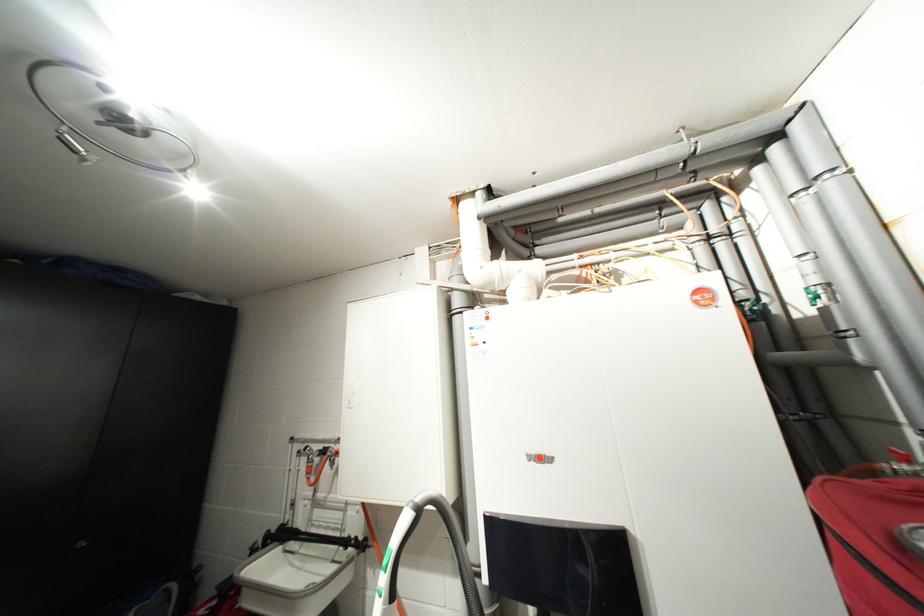
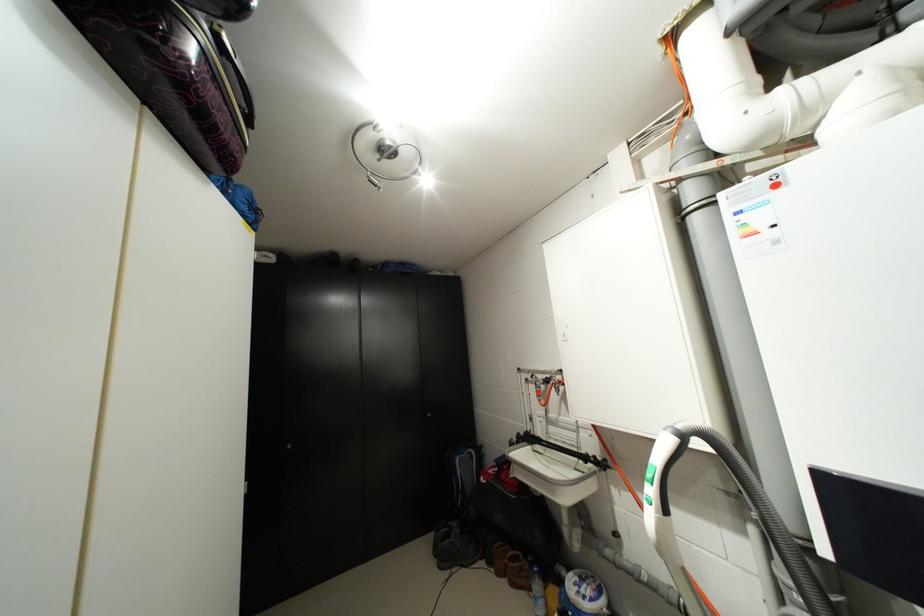
Question: How did the camera likely rotate?

Choices:
 (A) Left
 (B) Right
 (C) Up
 (D) Down

Answer: (A)